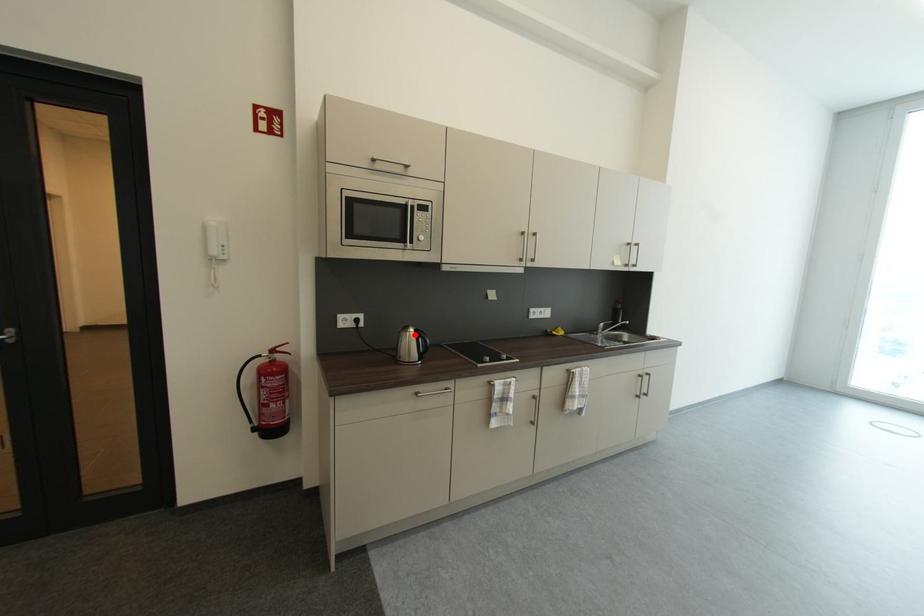
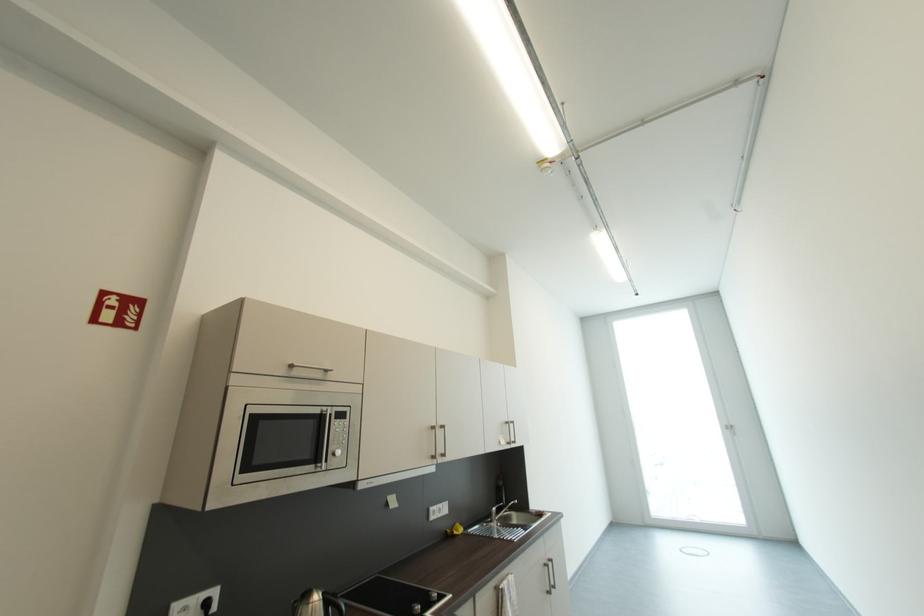
Find the pixel in the second image that matches the highlighted location in the first image.

(317, 607)